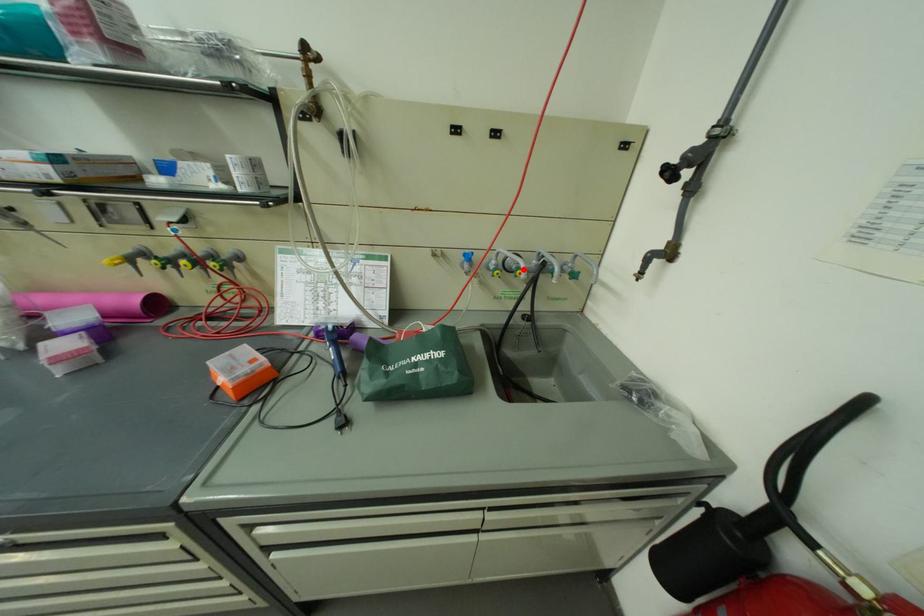
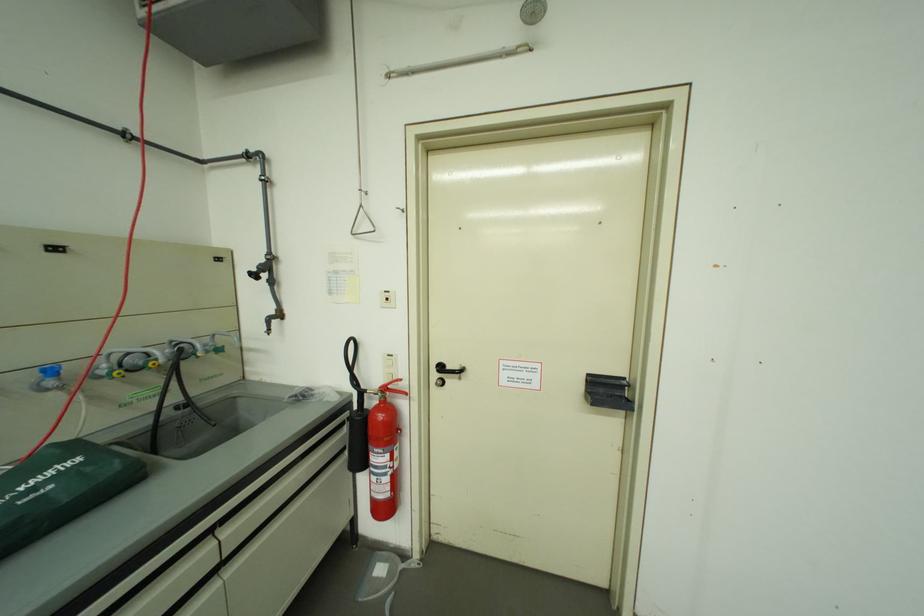
Where in the second image is the point corresponding to the highlighted location from the first image?

(150, 365)